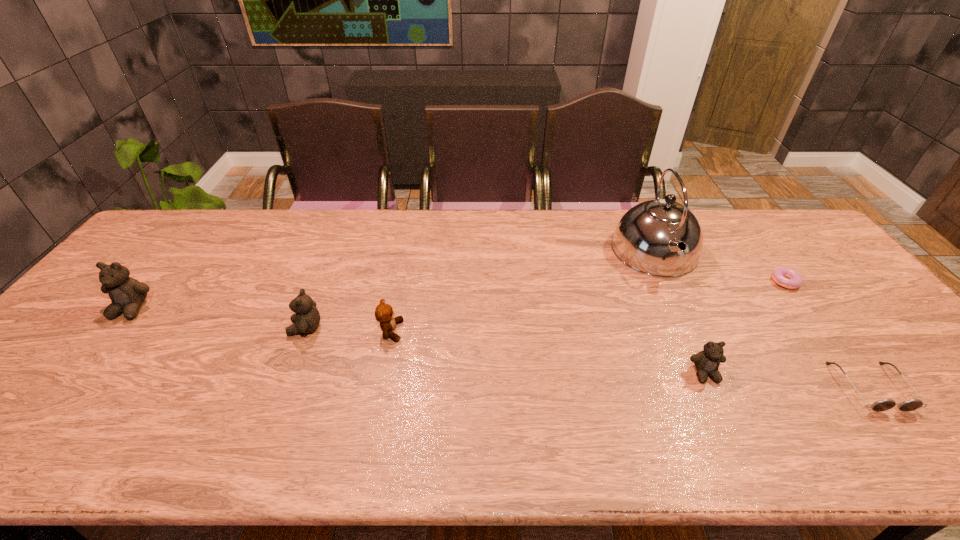
Select which teddy bear appears as the second closest to the kettle. Please provide its 2D coordinates. Your answer should be formatted as a tuple, i.e. [(x, y)], where the tuple contains the x and y coordinates of a point satisfying the conditions above.

[(384, 314)]

I want to click on the second closest teddy bear to the fifth object from right to left, so click(x=127, y=294).